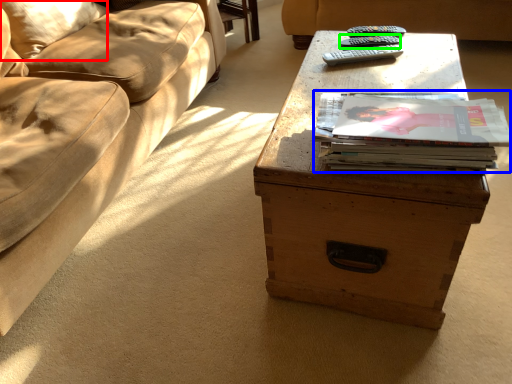
Question: Considering the real-world distances, which object is farthest from pillow (highlighted by a red box)? paperback book (highlighted by a blue box) or remote (highlighted by a green box)?

Choices:
 (A) paperback book
 (B) remote

Answer: (A)